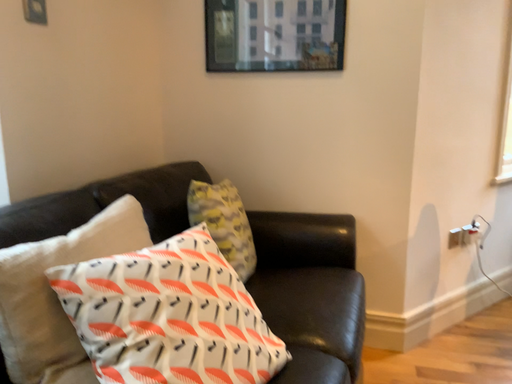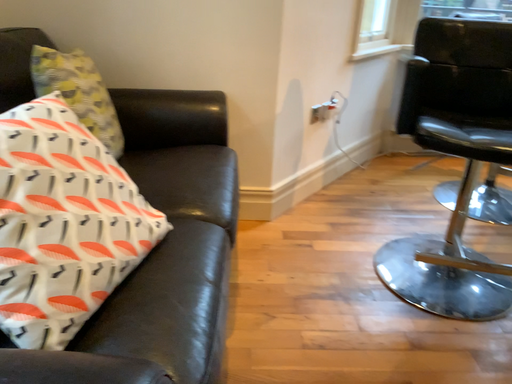
Question: How did the camera likely rotate when shooting the video?

Choices:
 (A) rotated downward
 (B) rotated upward

Answer: (A)